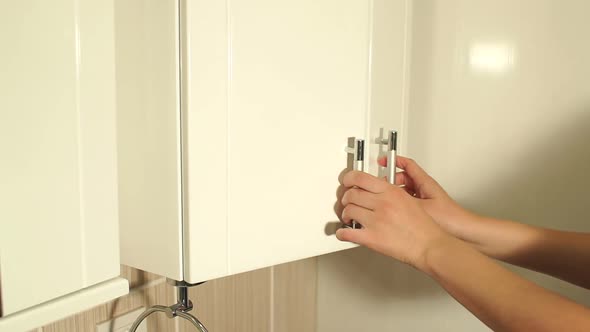
This screenshot has height=332, width=590. Find the location of `wall`. wall is located at coordinates (490, 113).